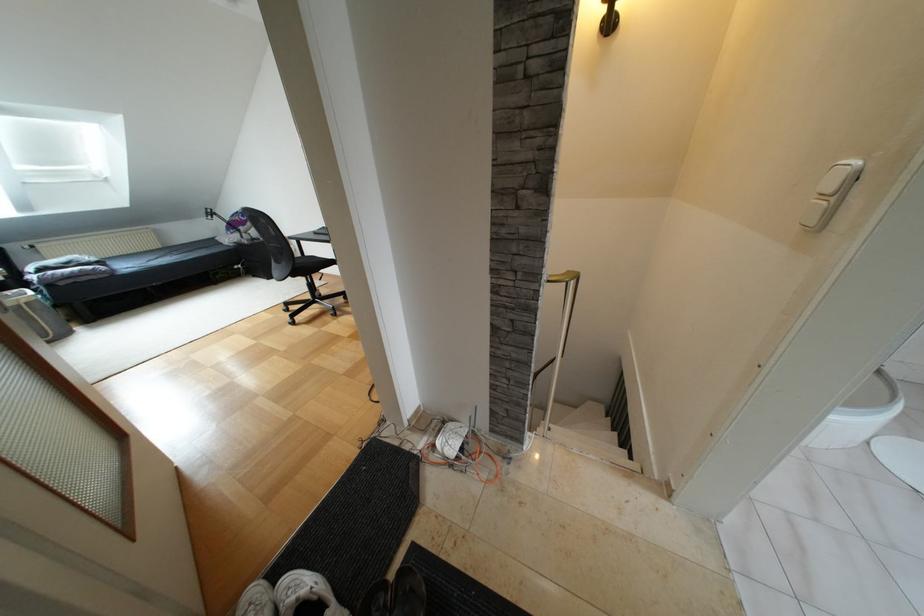
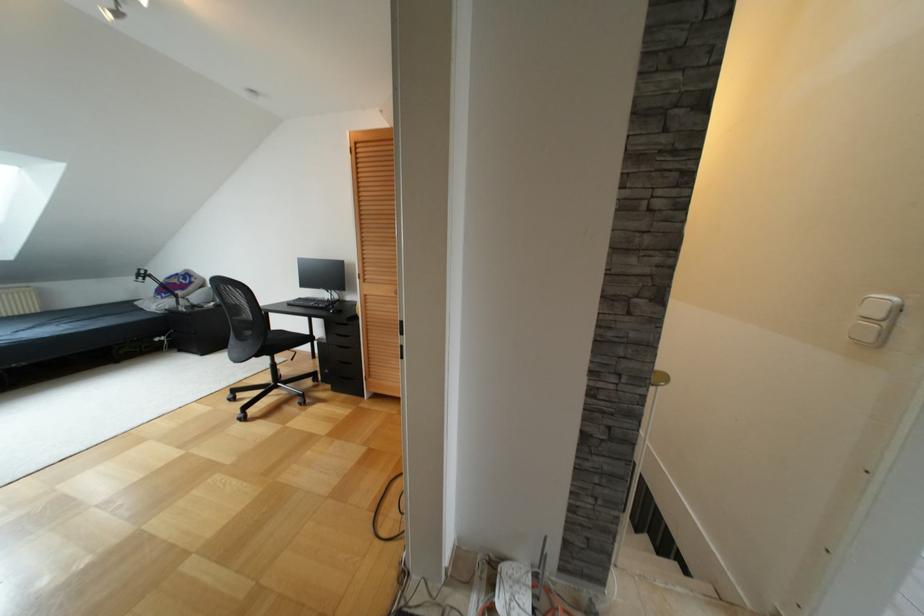
Question: The first image is from the beginning of the video and the second image is from the end. How did the camera likely rotate when shooting the video?

Choices:
 (A) Left
 (B) Right
 (C) Up
 (D) Down

Answer: (C)